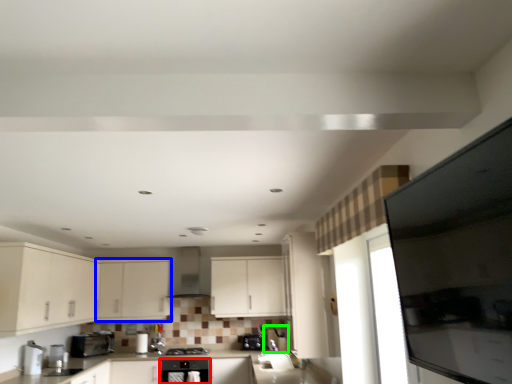
Question: Which object is positioned closest to home appliance (highlighted by a red box)? Select from cabinetry (highlighted by a blue box) and appliance (highlighted by a green box).

Choices:
 (A) cabinetry
 (B) appliance

Answer: (B)